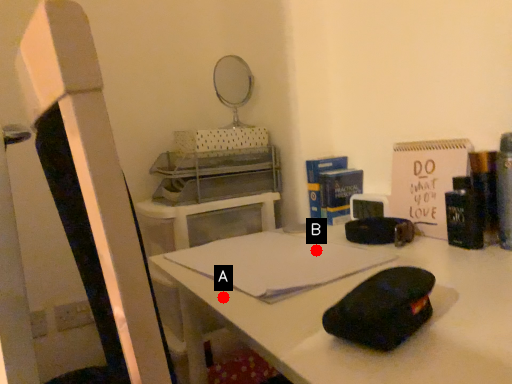
Question: Two points are circled on the image, labeled by A and B beside each circle. Among these points, which one is nearest to the camera?

Choices:
 (A) A is closer
 (B) B is closer

Answer: (A)